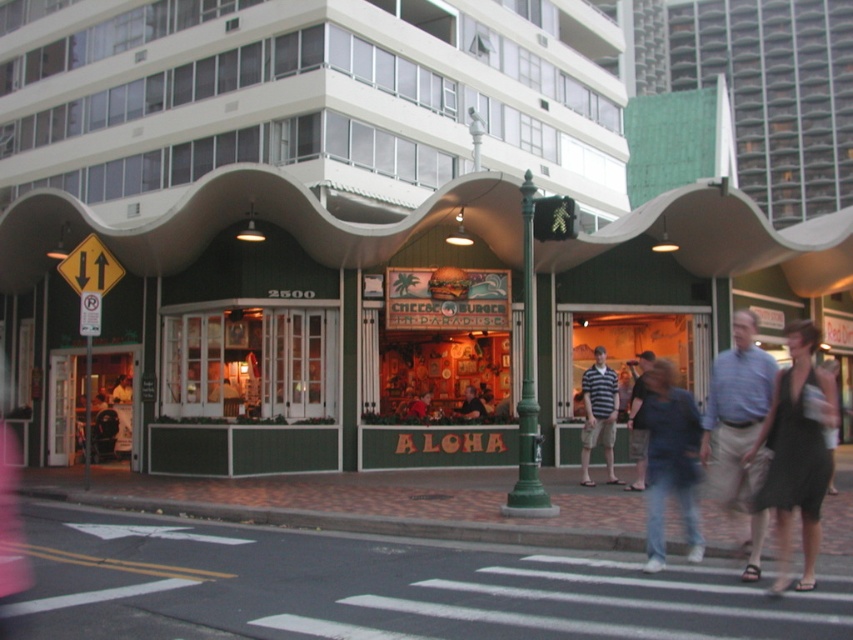
You are a fashion designer observing the Aloha restaurant scene. You notice the black textured dress at lower right and the green metal pole at center. Which object is shorter in height?

The black textured dress at lower right is shorter than the green metal pole at center.

You are standing at the entrance of the Aloha restaurant and want to take a photo that includes both the point at coordinates point (595, 397) and the point at coordinates point (468, 396). Which point should you focus on first to ensure both are in focus?

You should focus on point (595, 397) first because it is closer to you than point (468, 396), ensuring both points will be in focus when using a camera with a shallow depth of field.

You are a customer waiting to enter the Aloha restaurant. You notice two shirts hanging on a rack near the entrance. Which shirt is closer to you, the striped cotton shirt at center or the dark blue shirt at center?

The striped cotton shirt at center is closer to you because it is in front of the dark blue shirt at center.